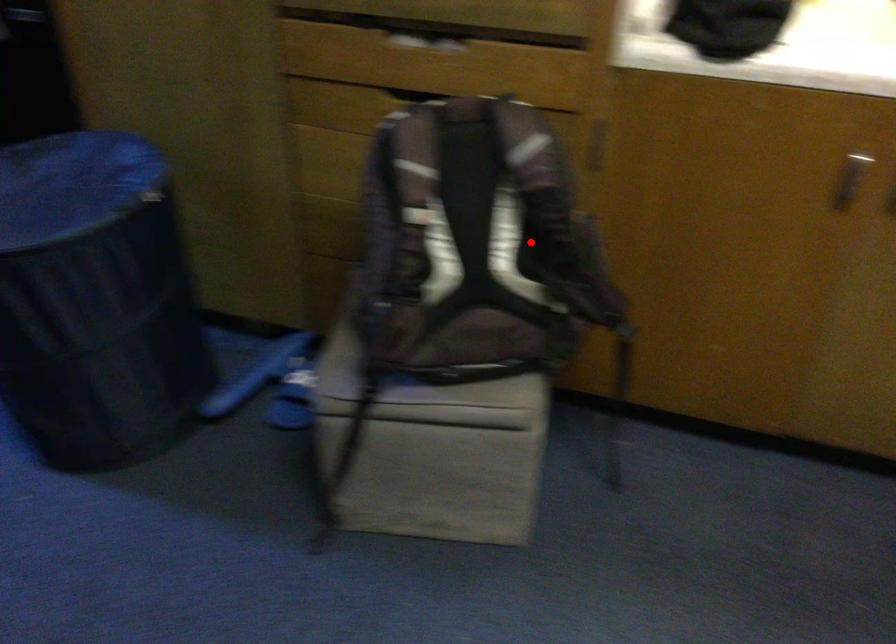
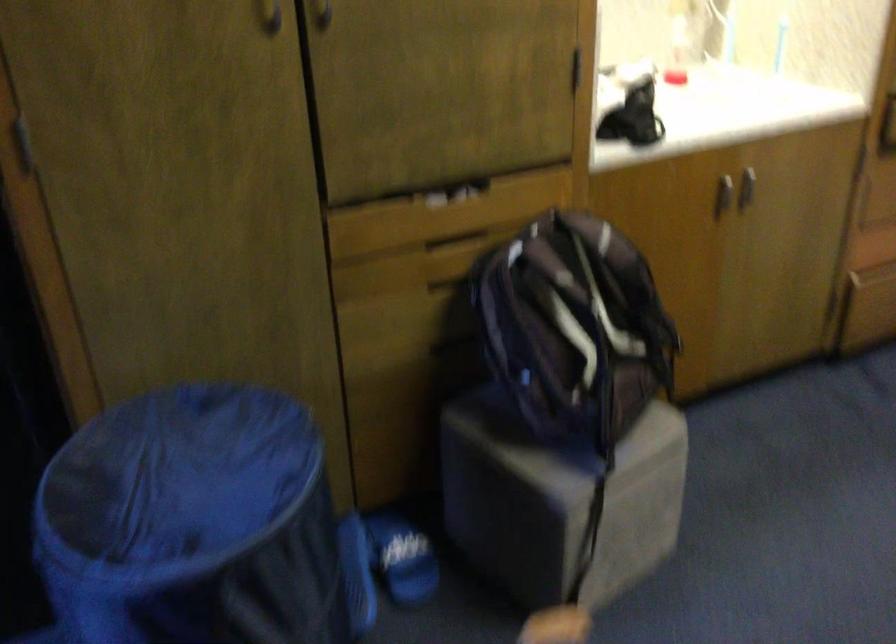
The point at the highlighted location is marked in the first image. Where is the corresponding point in the second image?

(607, 310)